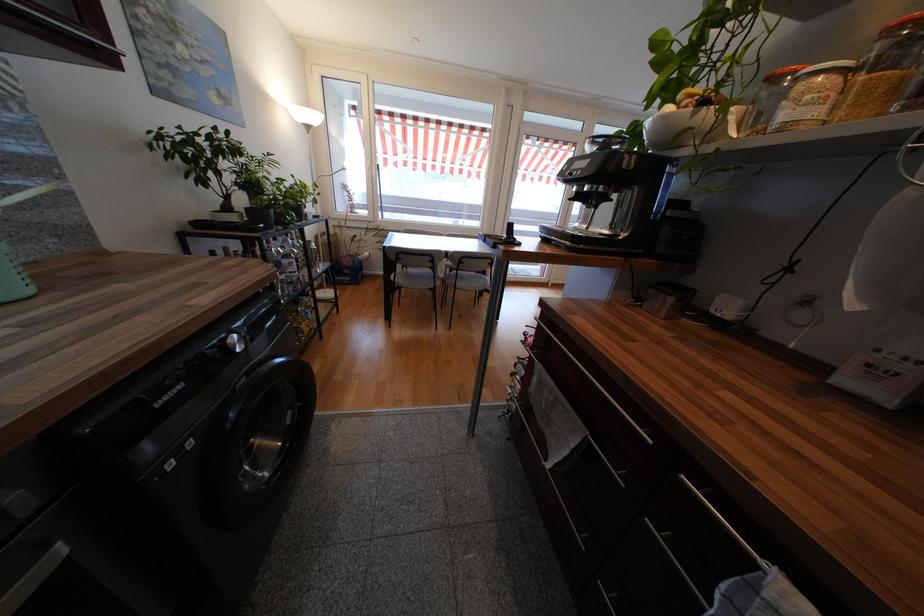
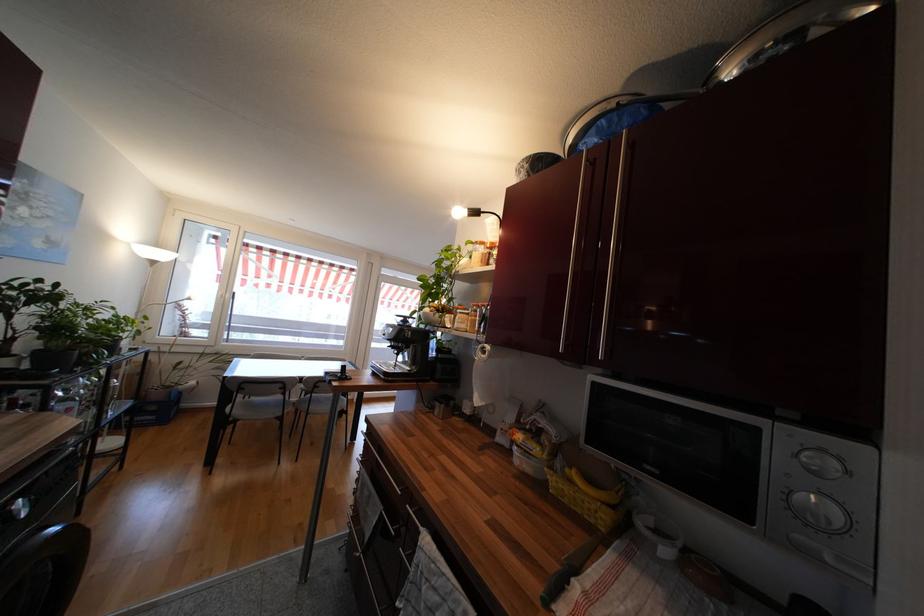
Locate, in the second image, the point that corresponds to point 458,274 in the first image.

(313, 398)